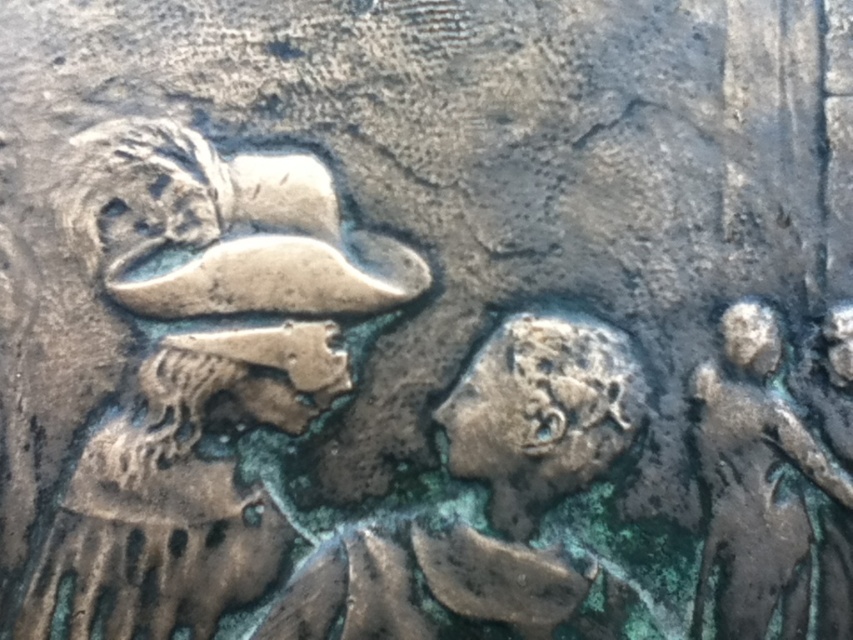
Locate an element on the screen. This screenshot has height=640, width=853. bronze textured bust at left is located at coordinates (199, 364).

Is bronze textured bust at left in front of green patina figure at right?

Yes, bronze textured bust at left is closer to the viewer.

Which is behind, point (123, 582) or point (764, 385)?

The point (764, 385) is more distant.

Image resolution: width=853 pixels, height=640 pixels. I want to click on bronze textured bust at left, so click(x=199, y=364).